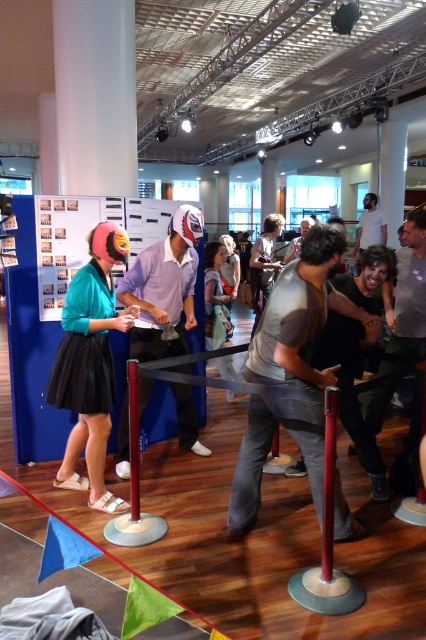
Is matte gray t-shirt at center to the left of white matte shirt at upper center from the viewer's perspective?

Indeed, matte gray t-shirt at center is positioned on the left side of white matte shirt at upper center.

Measure the distance from matte gray t-shirt at center to white matte shirt at upper center.

They are 18.43 feet apart.

Which is in front, point (247, 474) or point (359, 232)?

Point (247, 474) is in front.

In order to click on matte gray t-shirt at center in this screenshot , I will do `click(290, 371)`.

Can you confirm if white glossy pillar at upper center is shorter than smooth red pole at center?

In fact, white glossy pillar at upper center may be taller than smooth red pole at center.

Who is lower down, white glossy pillar at upper center or smooth red pole at center?

Positioned lower is smooth red pole at center.

This screenshot has width=426, height=640. What do you see at coordinates (391, 173) in the screenshot?
I see `white glossy pillar at upper center` at bounding box center [391, 173].

The image size is (426, 640). I want to click on white glossy pillar at upper center, so click(391, 173).

Who is more distant from viewer, [250,472] or [325,408]?

Point [250,472]

Which is in front, point (316, 428) or point (334, 460)?

Positioned in front is point (334, 460).

Locate an element on the screen. matte gray t-shirt at center is located at coordinates (290, 371).